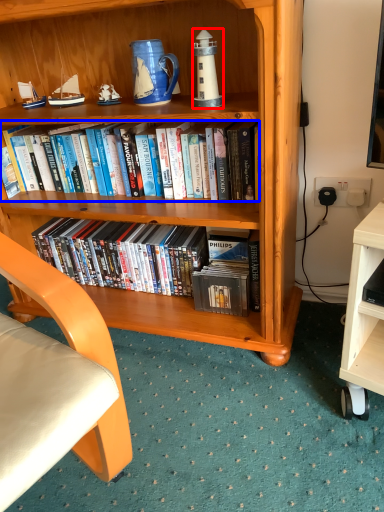
Question: Which point is closer to the camera, lamp (highlighted by a red box) or book (highlighted by a blue box)?

Choices:
 (A) lamp
 (B) book

Answer: (A)